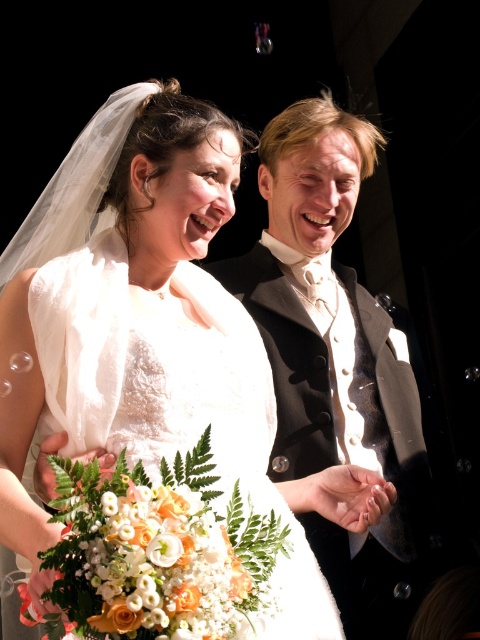
You are a photographer at a wedding. You need to adjust your camera focus to capture both the shiny black suit at center and the white satin dress at center. Which one should you focus on first to ensure the subject closer to you is in sharp focus?

The shiny black suit at center is closer to you than the white satin dress at center, so you should focus on the shiny black suit at center first to ensure it is in sharp focus.

Looking at this image, you are a photographer standing at the center of the wedding scene. You want to take a photo that includes both the point at coordinates point(264, 269) and point(155, 340). Which point should you focus on first to ensure both are in sharp focus?

Since point(264, 269) is closer to you than point(155, 340), you should focus on point(264, 269) first to ensure both are in sharp focus.